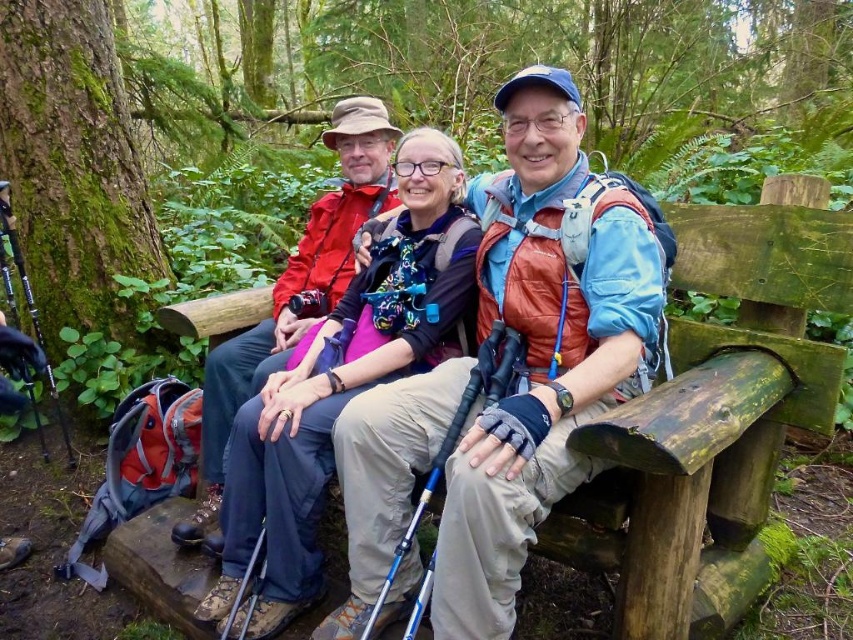
You are standing in the forest and want to take a photo of the point at coordinates [541,168]. Your camera has a focal length of 50mm and you are 1.68 meters away from the point. What is the angle of view required to capture the entire scene around that point in your photo?

The point at coordinates [541,168] is 1.68 meters away from the viewer. To calculate the angle of view needed, use the formula angle of view equals two times the arctangent of half the sensor width divided by the focal length multiplied by the distance. However, without knowing the sensor size, it is impossible to determine the exact angle of view required.

You are a photographer trying to capture a group photo of the matte blue jacket at center and the weathered wood bench at center. From which side of the bench should you position yourself to ensure both subjects are fully visible in the frame?

Answer: You should position yourself to the right side of the weathered wood bench at center because the matte blue jacket at center is on the left side of the bench, so placing yourself on the right side will allow both subjects to be fully visible in the frame.